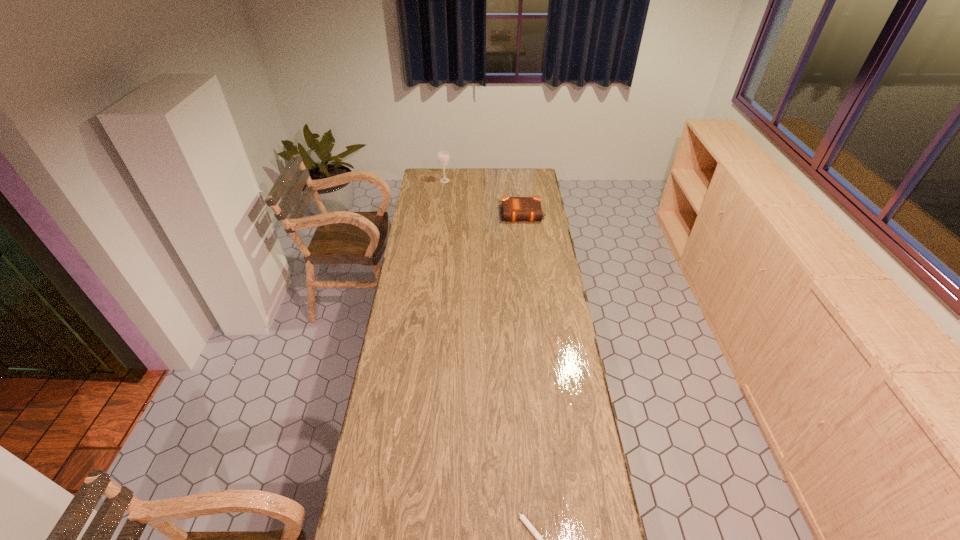
Where is `free region at the far edge of the desktop`? The width and height of the screenshot is (960, 540). free region at the far edge of the desktop is located at coordinates (490, 188).

The height and width of the screenshot is (540, 960). What are the coordinates of `blank space at the left edge` in the screenshot? It's located at (400, 473).

I want to click on vacant space at the right edge, so click(x=545, y=260).

You are a GUI agent. You are given a task and a screenshot of the screen. Output one action in this format:
    pyautogui.click(x=<x>, y=<y>)
    Task: Click on the free space at the far right corner of the desktop
    
    Given the screenshot: What is the action you would take?
    pyautogui.click(x=523, y=173)

Where is `vacant space that is in between the tallest object and the Bible`? vacant space that is in between the tallest object and the Bible is located at coordinates [484, 197].

Where is `object that is the closest to the syringe`? object that is the closest to the syringe is located at coordinates (514, 209).

Locate which object ranks second in proximity to the syringe. Please provide its 2D coordinates. Your answer should be formatted as a tuple, i.e. [(x, y)], where the tuple contains the x and y coordinates of a point satisfying the conditions above.

[(443, 158)]